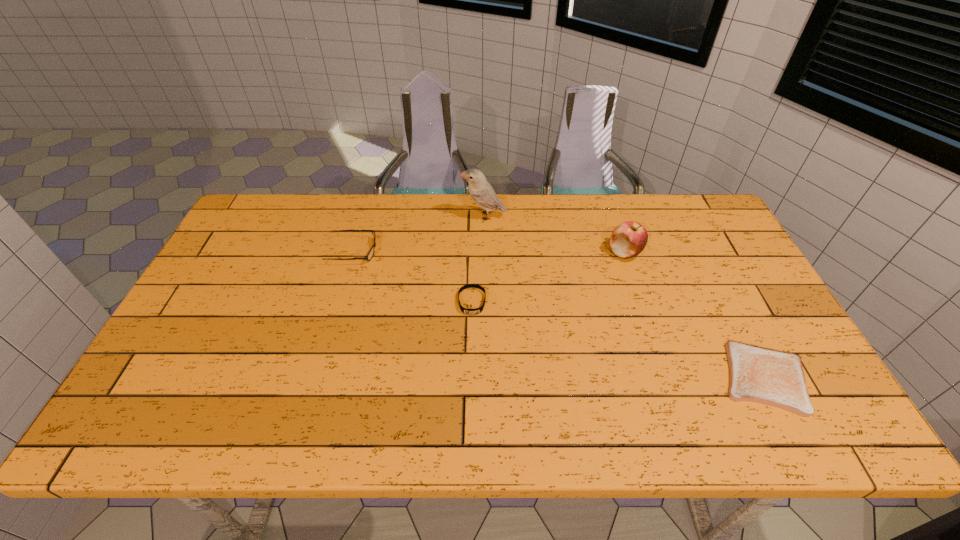
Where is `vacant region located at the face of the farthest object`? This screenshot has width=960, height=540. vacant region located at the face of the farthest object is located at coordinates (341, 217).

This screenshot has width=960, height=540. Identify the location of vacant space situated at the face of the farthest object. (430, 217).

Identify the location of free region located at the face of the farthest object. The width and height of the screenshot is (960, 540). pyautogui.click(x=427, y=217).

The image size is (960, 540). Find the location of `free space located on the left of the apple`. free space located on the left of the apple is located at coordinates (552, 252).

What are the coordinates of `vacant area located on the front-facing side of the sunglasses` in the screenshot? It's located at (468, 251).

Image resolution: width=960 pixels, height=540 pixels. I want to click on free point located on the display of the fourth tallest object, so (469, 439).

Where is `free space located on the back of the rightmost object`? free space located on the back of the rightmost object is located at coordinates (707, 264).

What are the coordinates of `bird that is positioned at the far edge` in the screenshot? It's located at (480, 190).

This screenshot has height=540, width=960. I want to click on sunglasses that is at the far edge, so tap(371, 252).

Locate an element on the screen. The width and height of the screenshot is (960, 540). object located in the near edge section of the desktop is located at coordinates (758, 374).